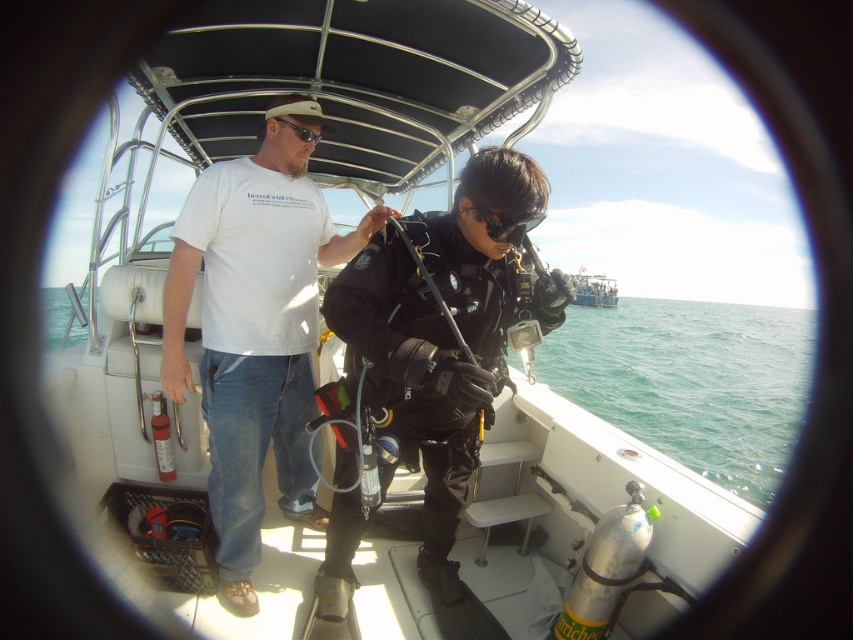
Between white cotton t-shirt at upper center and black matte diving suit at center, which one has more height?

white cotton t-shirt at upper center

Which of these two, white cotton t-shirt at upper center or black matte diving suit at center, stands shorter?

black matte diving suit at center

Between point (206, 268) and point (422, 365), which one is positioned in front?

Positioned in front is point (422, 365).

The image size is (853, 640). What are the coordinates of `white cotton t-shirt at upper center` in the screenshot? It's located at (254, 330).

Who is shorter, metallic gray boat at center or black matte goggles at center?

black matte goggles at center is shorter.

This screenshot has width=853, height=640. Find the location of `metallic gray boat at center`. metallic gray boat at center is located at coordinates (593, 289).

Between point (602, 291) and point (521, 225), which one is positioned behind?

Point (602, 291)

Image resolution: width=853 pixels, height=640 pixels. Identify the location of metallic gray boat at center. (593, 289).

Who is taller, black matte diving suit at center or matte black goggles at upper center?

black matte diving suit at center is taller.

Does point (354, 275) come in front of point (282, 120)?

Yes, it is in front of point (282, 120).

Locate an element on the screen. black matte diving suit at center is located at coordinates (444, 333).